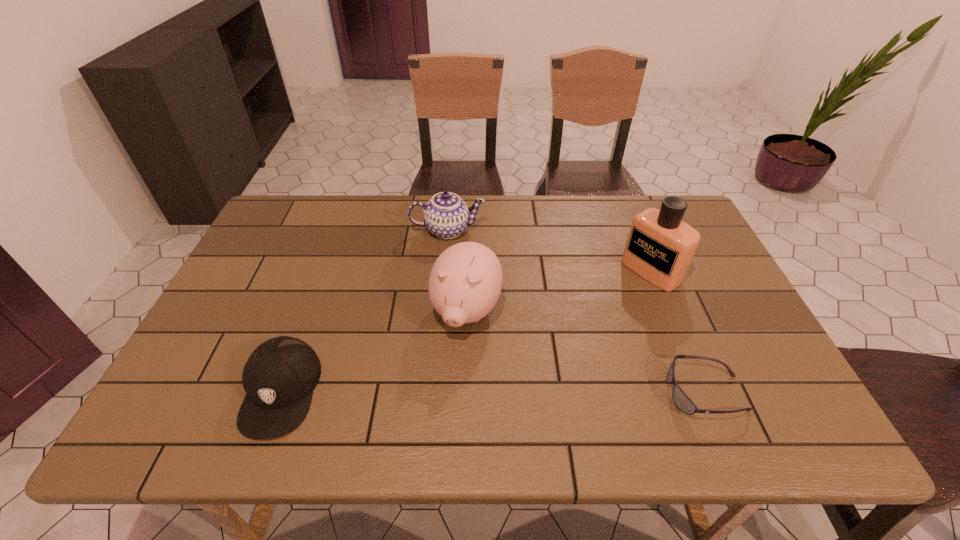
Locate an element on the screen. free space at the near right corner of the desktop is located at coordinates (759, 386).

Locate an element on the screen. free space between the second shortest object and the fourth shortest object is located at coordinates (373, 351).

You are a GUI agent. You are given a task and a screenshot of the screen. Output one action in this format:
    pyautogui.click(x=<x>, y=<y>)
    Task: Click on the free space between the tallest object and the cap
    This screenshot has width=960, height=540.
    Given the screenshot: What is the action you would take?
    pyautogui.click(x=466, y=331)

This screenshot has width=960, height=540. In order to click on free spot between the second shortest object and the sunglasses in this screenshot , I will do `click(492, 392)`.

The width and height of the screenshot is (960, 540). What are the coordinates of `vacant point located between the tallest object and the second tallest object` in the screenshot? It's located at (559, 291).

The width and height of the screenshot is (960, 540). What are the coordinates of `vacant point located between the tallest object and the second tallest object` in the screenshot? It's located at (559, 291).

What are the coordinates of `free space between the third tallest object and the perfume` in the screenshot? It's located at (549, 251).

This screenshot has width=960, height=540. I want to click on free spot between the shortest object and the perfume, so click(x=678, y=332).

At what (x,y) coordinates should I click in order to perform the action: click on free space between the cap and the tallest object. Please return your answer as a coordinate pair (x, y). This screenshot has width=960, height=540. Looking at the image, I should click on (466, 331).

Where is `object that stands as the closest to the leftmost object`? The image size is (960, 540). object that stands as the closest to the leftmost object is located at coordinates (465, 282).